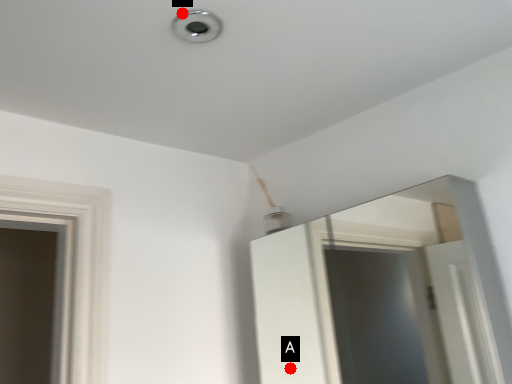
Question: Two points are circled on the image, labeled by A and B beside each circle. Which point appears farthest from the camera in this image?

Choices:
 (A) A is further
 (B) B is further

Answer: (A)